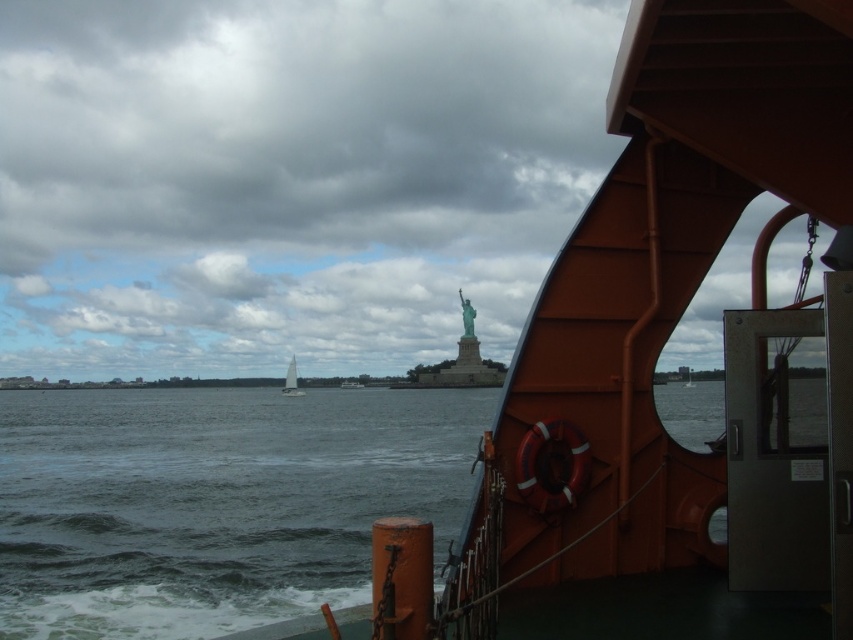
Question: Which point is farther to the camera?

Choices:
 (A) green patina statue at center
 (B) dark gray water at center
 (C) white sailboat at center

Answer: (A)

Question: Considering the relative positions of dark gray water at center and white sailboat at center in the image provided, where is dark gray water at center located with respect to white sailboat at center?

Choices:
 (A) above
 (B) below

Answer: (A)

Question: Among these points, which one is farthest from the camera?

Choices:
 (A) (227, 548)
 (B) (291, 356)
 (C) (467, 330)

Answer: (B)

Question: Considering the real-world distances, which object is farthest from the white sailboat at center?

Choices:
 (A) dark gray water at center
 (B) green patina statue at center

Answer: (A)

Question: Can you confirm if green patina statue at center is wider than white sailboat at center?

Choices:
 (A) no
 (B) yes

Answer: (A)

Question: Where is green patina statue at center located in relation to white sailboat at center in the image?

Choices:
 (A) below
 (B) above

Answer: (B)